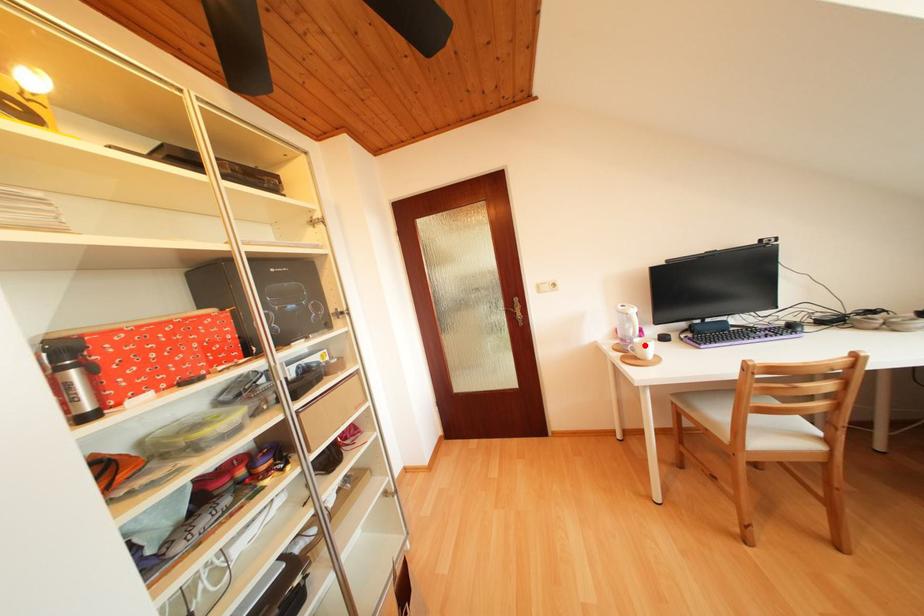
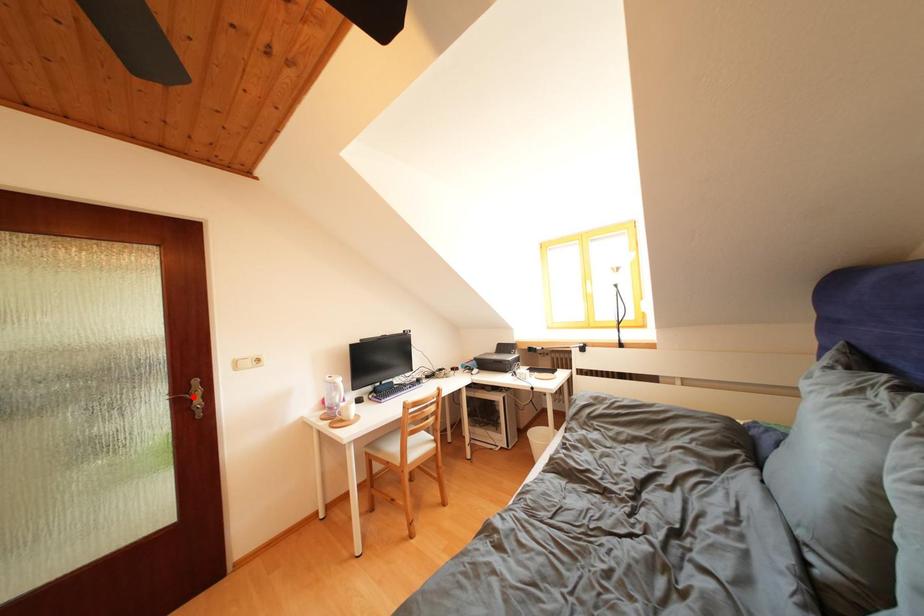
I am providing you with two images of the same scene from different viewpoints. A red point is marked on the first image and another point is marked on the second image. Are the points marked in image1 and image2 representing the same 3D position?

No